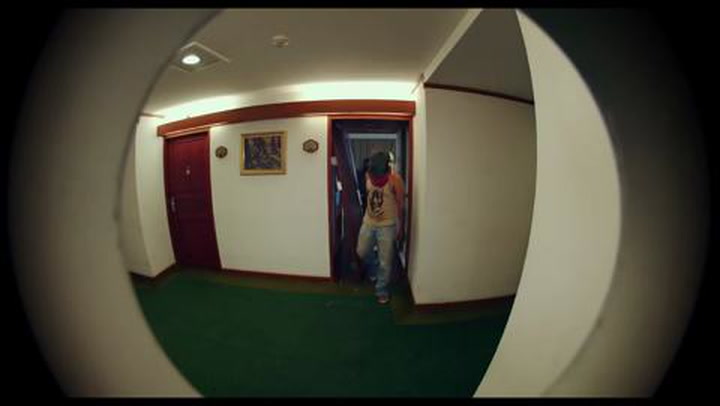
Identify the location of wall. The width and height of the screenshot is (720, 406). (521, 209).